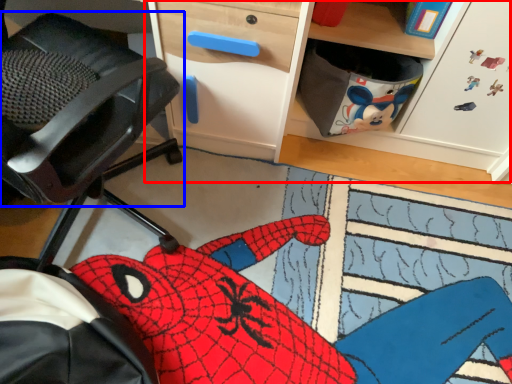
Question: Which object is further to the camera taking this photo, computer desk (highlighted by a red box) or chair (highlighted by a blue box)?

Choices:
 (A) computer desk
 (B) chair

Answer: (A)